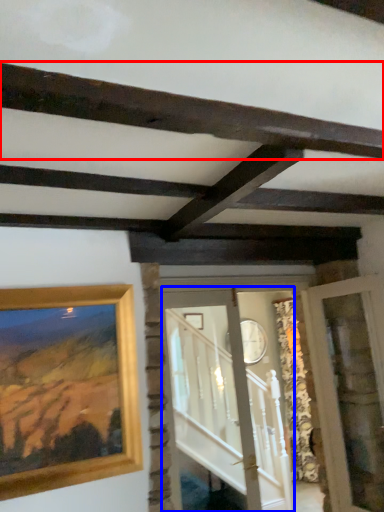
Question: Which object is further to the camera taking this photo, plank (highlighted by a red box) or glass door (highlighted by a blue box)?

Choices:
 (A) plank
 (B) glass door

Answer: (B)